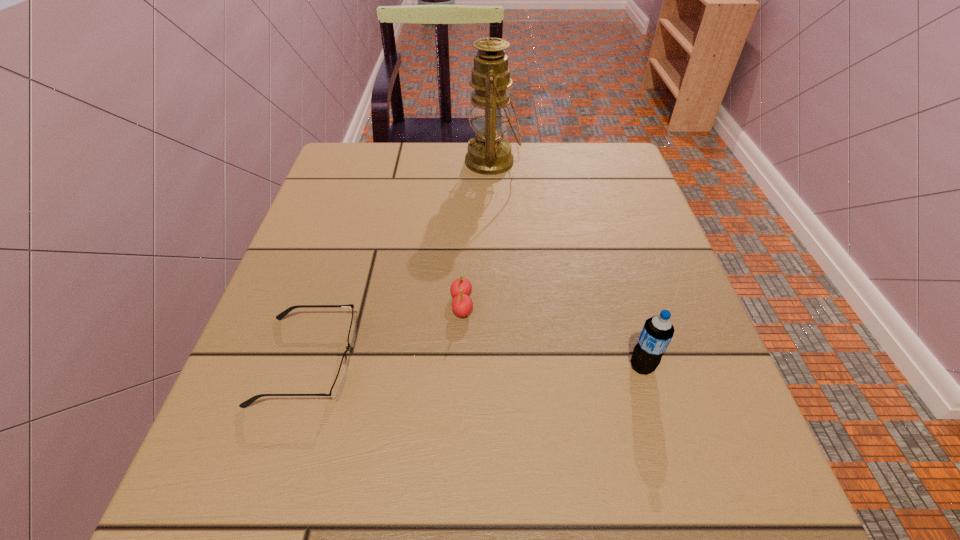
You are a GUI agent. You are given a task and a screenshot of the screen. Output one action in this format:
    pyautogui.click(x=<x>, y=<y>)
    Task: Click on the free space between the oil lamp and the second tallest object
    
    Given the screenshot: What is the action you would take?
    pyautogui.click(x=567, y=264)

Find the location of a particular element. free space between the soda bottle and the leftmost object is located at coordinates (474, 363).

Identify the location of free space between the farthest object and the leftmost object. (399, 261).

Image resolution: width=960 pixels, height=540 pixels. Find the location of `unoccupied area between the leftmost object and the rightmost object`. unoccupied area between the leftmost object and the rightmost object is located at coordinates (474, 363).

I want to click on blank region between the cherry and the oil lamp, so click(477, 233).

At what (x,y) coordinates should I click in order to perform the action: click on vacant space in between the spectacles and the farthest object. Please return your answer as a coordinate pair (x, y). The height and width of the screenshot is (540, 960). Looking at the image, I should click on (399, 261).

Find the location of a particular element. free space that is in between the second shortest object and the spectacles is located at coordinates (385, 333).

Locate an element on the screen. The width and height of the screenshot is (960, 540). free space between the shortest object and the rightmost object is located at coordinates (474, 363).

Image resolution: width=960 pixels, height=540 pixels. What are the coordinates of `vacant area that lies between the leftmost object and the third shortest object` in the screenshot? It's located at pos(474,363).

Identify which object is the second closest to the soda bottle. Please provide its 2D coordinates. Your answer should be formatted as a tuple, i.e. [(x, y)], where the tuple contains the x and y coordinates of a point satisfying the conditions above.

[(338, 385)]